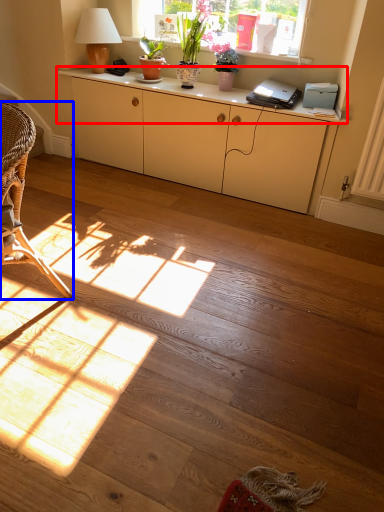
Question: Which point is further to the camera, desk (highlighted by a red box) or chair (highlighted by a blue box)?

Choices:
 (A) desk
 (B) chair

Answer: (A)